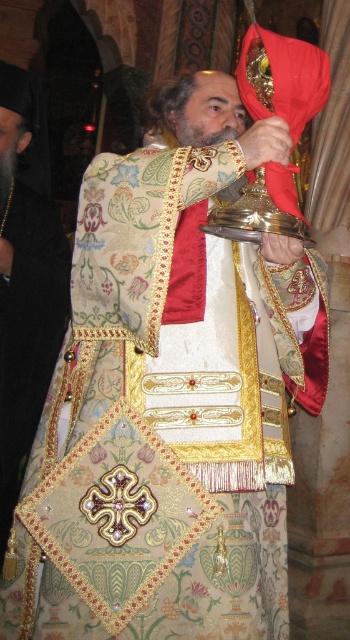
Which of these two, gold embroidered vestment at center or grayish-brown beard at center, stands taller?

Standing taller between the two is gold embroidered vestment at center.

In the scene shown: Does gold embroidered vestment at center have a larger size compared to grayish-brown beard at center?

Yes, gold embroidered vestment at center is bigger than grayish-brown beard at center.

Find the location of `gold embroidered vestment at center`. gold embroidered vestment at center is located at coordinates (25, 278).

At what (x,y) coordinates should I click in order to perform the action: click on gold embroidered vestment at center. Please return your answer as a coordinate pair (x, y). This screenshot has width=350, height=640. Looking at the image, I should click on (25, 278).